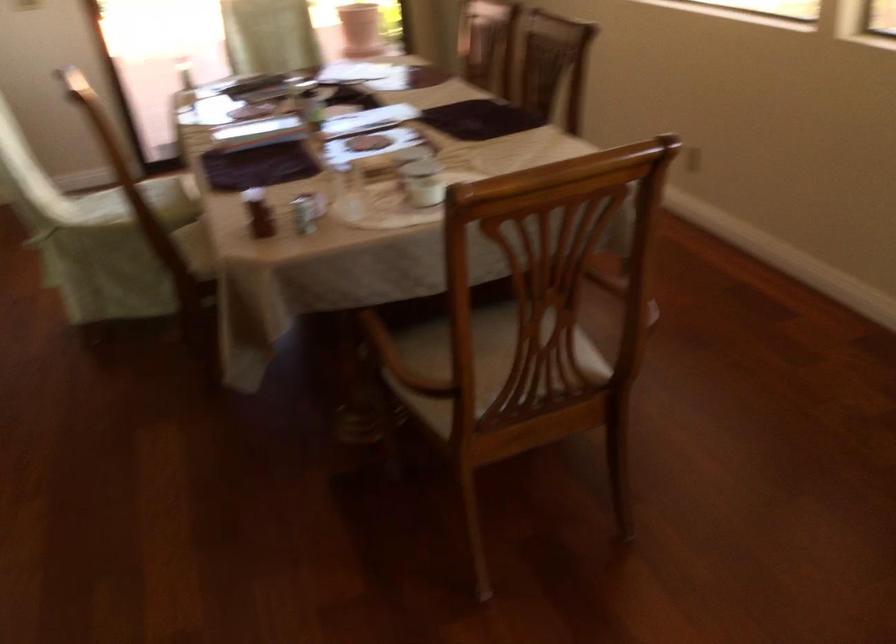
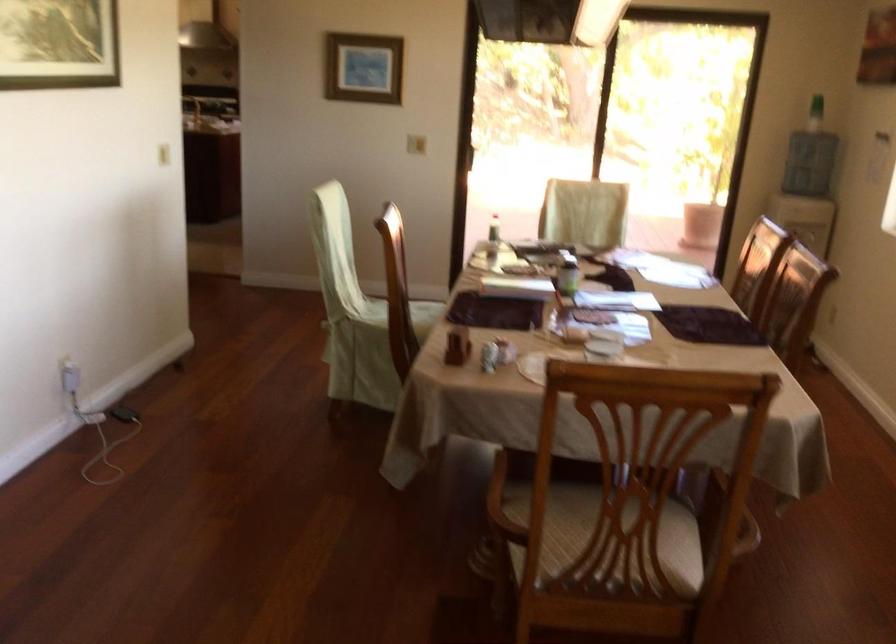
Locate, in the second image, the point that corresponds to point 145,486 in the first image.

(316, 540)